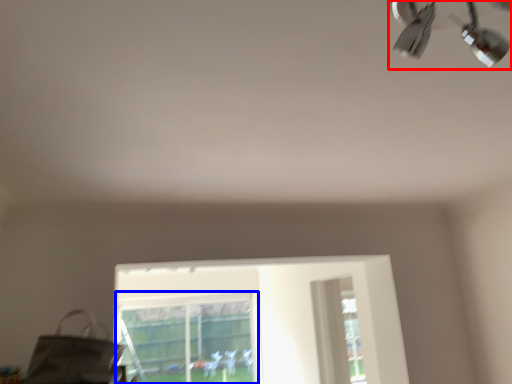
Question: Among these objects, which one is nearest to the camera, lamp (highlighted by a red box) or bay window (highlighted by a blue box)?

Choices:
 (A) lamp
 (B) bay window

Answer: (A)